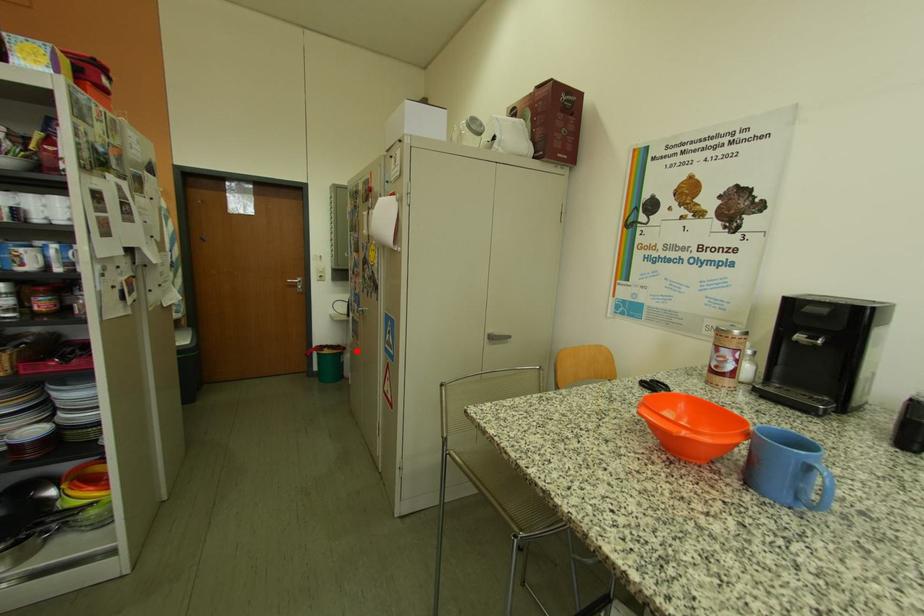
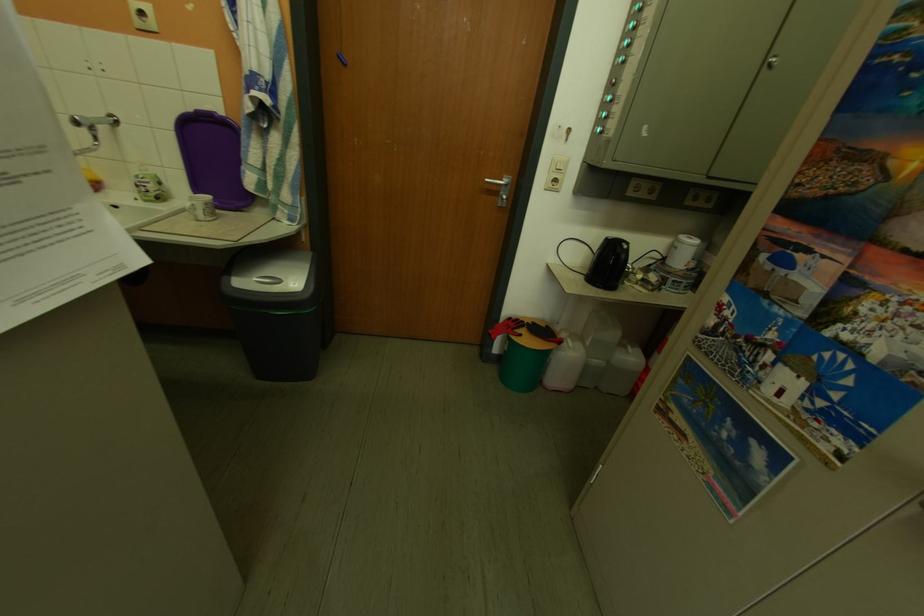
Question: I am providing you with two images of the same scene from different viewpoints. A red point is shown in image1. For the corresponding object point in image2, is it positioned nearer or farther from the camera?

Choices:
 (A) Nearer
 (B) Farther

Answer: (A)